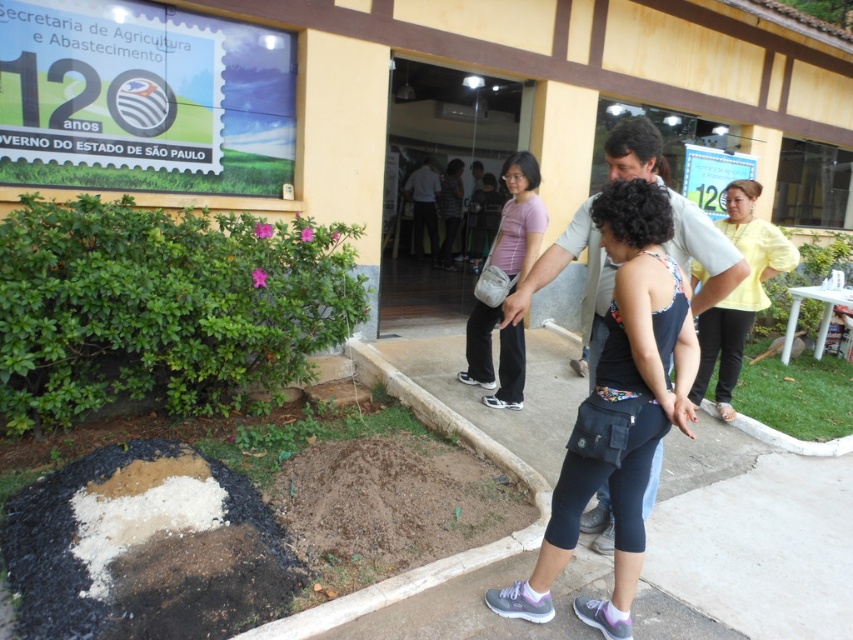
You are attending an outdoor event at the Secretaria de Agricultura e Abastecimento in Brazil. You see two people wearing a dark blue fabric tank top at center and a yellow matte shirt at right. Which person is wearing a narrower shirt?

The dark blue fabric tank top at center has a lesser width compared to the yellow matte shirt at right, so the person wearing the dark blue fabric tank top at center has a narrower shirt.

From the picture: You are standing at the Secretaria de Agricultura e Abastecimento building and want to place a new flower pot between the two points labeled point (628, 220) and point (467, 323). Based on their positions, which point is closer to the building facade?

Point (467, 323) is closer to the building facade because it is behind point (628, 220), which is in front of it.